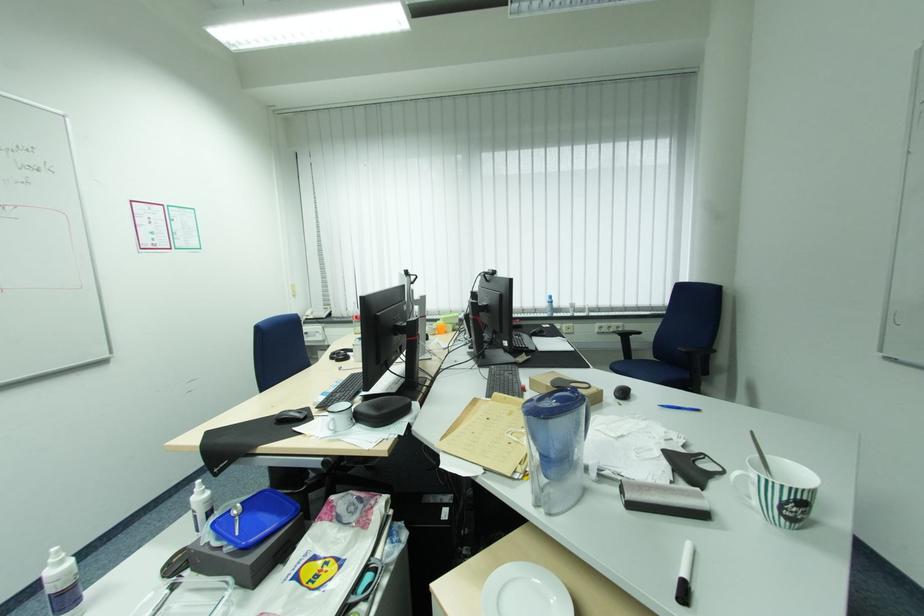
Find the location of a particular element. This screenshot has height=616, width=924. white mug handle is located at coordinates (337, 422).